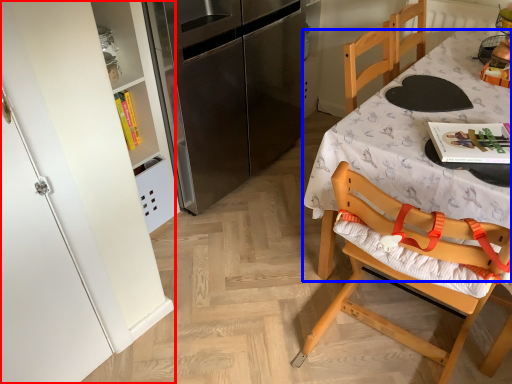
Question: Which object appears closest to the camera in this image, cabinetry (highlighted by a red box) or desk (highlighted by a blue box)?

Choices:
 (A) cabinetry
 (B) desk

Answer: (A)